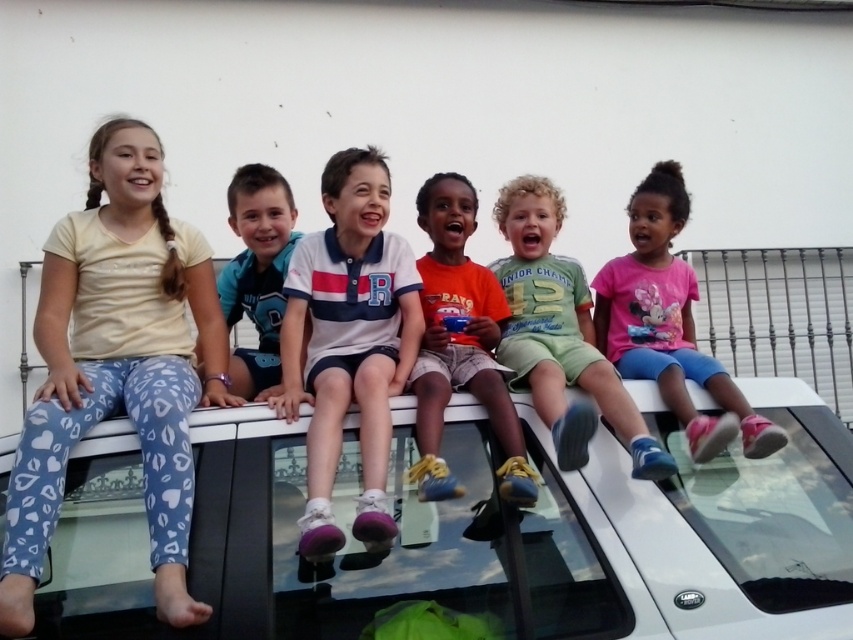
You are a photographer trying to capture a photo of the light blue leggings at left and the orange cotton shirt at center. Which object should you focus on first if you want to ensure both are in sharp focus, considering their sizes?

The light blue leggings at left is bigger than the orange cotton shirt at center, so you should focus on the light blue leggings at left first to ensure both are in sharp focus.